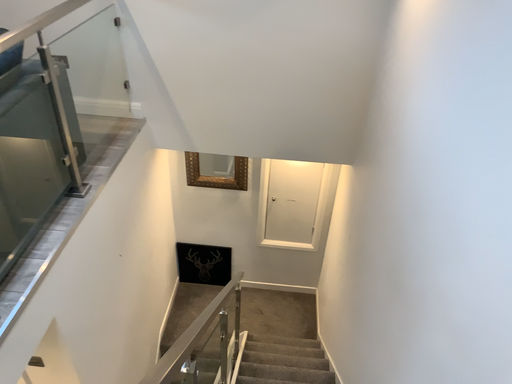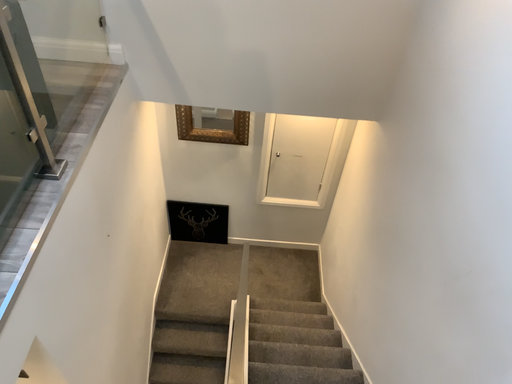
Question: Which way did the camera rotate in the video?

Choices:
 (A) rotated downward
 (B) rotated upward

Answer: (A)